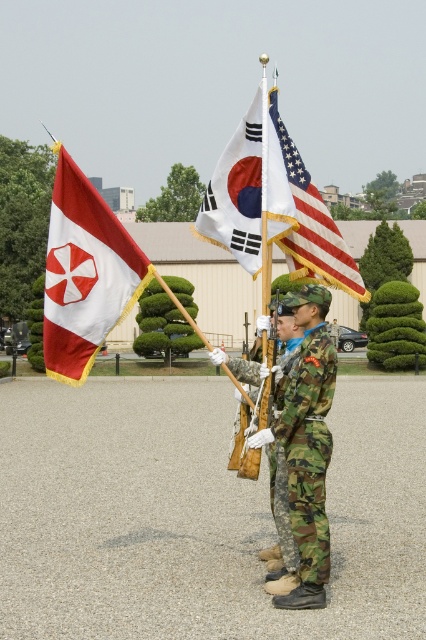
This screenshot has width=426, height=640. I want to click on camouflage fabric uniform at center, so click(307, 449).

Can you confirm if camouflage fabric uniform at center is positioned below camo fabric uniform at center?

No, camouflage fabric uniform at center is not below camo fabric uniform at center.

Who is more distant from viewer, (290, 518) or (278, 456)?

Point (278, 456)

Identify the location of camouflage fabric uniform at center. This screenshot has height=640, width=426. (307, 449).

Between white fabric flag at center and camo fabric uniform at center, which one appears on the left side from the viewer's perspective?

white fabric flag at center is more to the left.

Between white fabric flag at center and camo fabric uniform at center, which one appears on the right side from the viewer's perspective?

camo fabric uniform at center is more to the right.

Is point (227, 186) positioned behind point (282, 506)?

Yes, point (227, 186) is farther from viewer.

Find the location of a particular element. This screenshot has height=640, width=426. white fabric flag at center is located at coordinates (247, 189).

Between camouflage fabric uniform at center and american flag at center, which one is positioned higher?

Positioned higher is american flag at center.

You are a GUI agent. You are given a task and a screenshot of the screen. Output one action in this format:
    pyautogui.click(x=<x>, y=<y>)
    Task: Click on the camouflage fabric uniform at center
    Image resolution: width=426 pixels, height=640 pixels.
    Given the screenshot: What is the action you would take?
    pyautogui.click(x=307, y=449)

Where is `camouflage fabric uniform at center`? This screenshot has height=640, width=426. camouflage fabric uniform at center is located at coordinates (307, 449).